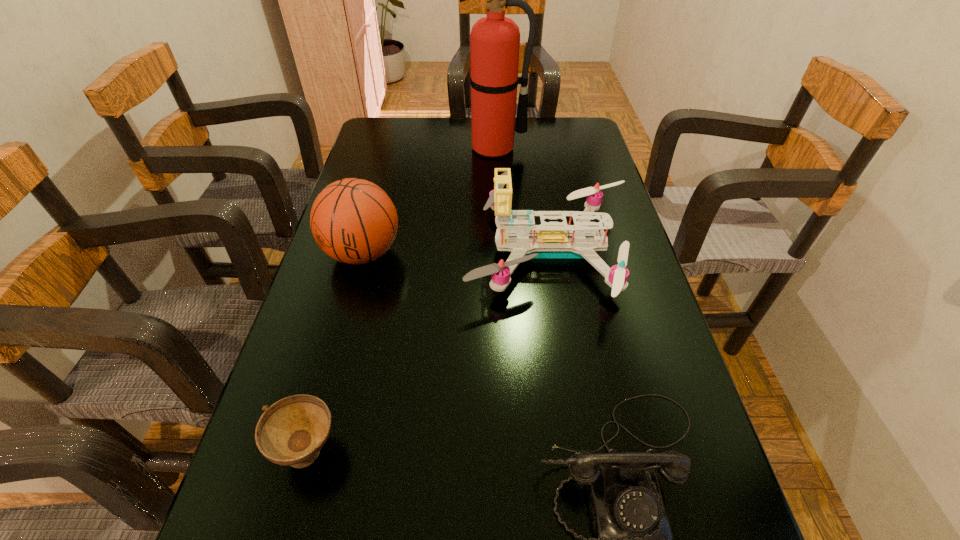
The image size is (960, 540). Find the location of `vacant space that is in between the tallest object and the soup bowl`. vacant space that is in between the tallest object and the soup bowl is located at coordinates (401, 299).

The image size is (960, 540). What are the coordinates of `vacant area that lies between the farthest object and the soup bowl` in the screenshot? It's located at (401, 299).

The image size is (960, 540). What are the coordinates of `free space between the basketball and the farthest object` in the screenshot? It's located at (429, 201).

Find the location of a particular element. blank region between the drone and the fire extinguisher is located at coordinates (522, 200).

The height and width of the screenshot is (540, 960). I want to click on free space between the drone and the tallest object, so 522,200.

Where is `vacant area that lies between the soup bowl and the drone`? The width and height of the screenshot is (960, 540). vacant area that lies between the soup bowl and the drone is located at coordinates (429, 350).

Select which object is the fourth closest to the drone. Please provide its 2D coordinates. Your answer should be formatted as a tuple, i.e. [(x, y)], where the tuple contains the x and y coordinates of a point satisfying the conditions above.

[(292, 431)]

Find the location of a particular element. The height and width of the screenshot is (540, 960). object that ranks as the second closest to the telephone is located at coordinates (292, 431).

Image resolution: width=960 pixels, height=540 pixels. What are the coordinates of `free space that satisfies the following two spatial constraints: 1. on the front-facing side of the drone; 2. on the front side of the basketball` in the screenshot? It's located at (550, 253).